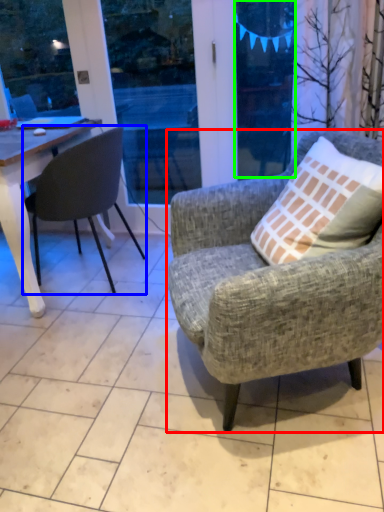
Question: Based on their relative distances, which object is farther from chair (highlighted by a red box)? Choose from chair (highlighted by a blue box) and window screen (highlighted by a green box).

Choices:
 (A) chair
 (B) window screen

Answer: (B)